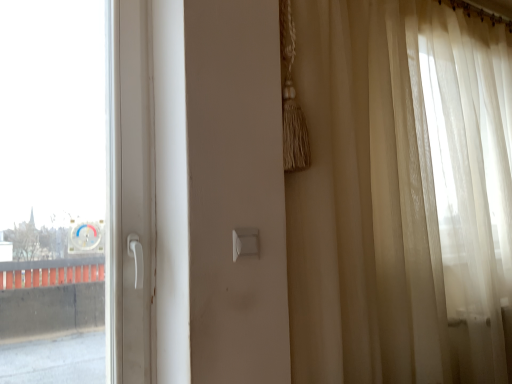
Question: Considering the relative sizes of white plastic light switch at center and sheer beige curtain at right in the image provided, is white plastic light switch at center wider than sheer beige curtain at right?

Choices:
 (A) no
 (B) yes

Answer: (A)

Question: Could you tell me if white plastic light switch at center is turned towards sheer beige curtain at right?

Choices:
 (A) yes
 (B) no

Answer: (B)

Question: Does white plastic light switch at center appear on the left side of sheer beige curtain at right?

Choices:
 (A) yes
 (B) no

Answer: (A)

Question: Is white plastic light switch at center smaller than sheer beige curtain at right?

Choices:
 (A) no
 (B) yes

Answer: (B)

Question: From a real-world perspective, is white plastic light switch at center on top of sheer beige curtain at right?

Choices:
 (A) no
 (B) yes

Answer: (A)

Question: From a real-world perspective, is white plastic light switch at center positioned under sheer beige curtain at right based on gravity?

Choices:
 (A) no
 (B) yes

Answer: (B)

Question: Can you confirm if sheer beige curtain at right is positioned to the right of white plastic light switch at center?

Choices:
 (A) yes
 (B) no

Answer: (A)

Question: From a real-world perspective, is sheer beige curtain at right physically above white plastic light switch at center?

Choices:
 (A) yes
 (B) no

Answer: (A)

Question: From a real-world perspective, is sheer beige curtain at right located beneath white plastic light switch at center?

Choices:
 (A) yes
 (B) no

Answer: (B)

Question: Can you confirm if sheer beige curtain at right is taller than white plastic light switch at center?

Choices:
 (A) yes
 (B) no

Answer: (A)

Question: Does sheer beige curtain at right appear on the left side of white plastic light switch at center?

Choices:
 (A) yes
 (B) no

Answer: (B)

Question: Is white plastic light switch at center completely or partially inside sheer beige curtain at right?

Choices:
 (A) yes
 (B) no

Answer: (B)

Question: Relative to white plastic light switch at center, is sheer beige curtain at right in front or behind?

Choices:
 (A) front
 (B) behind

Answer: (A)